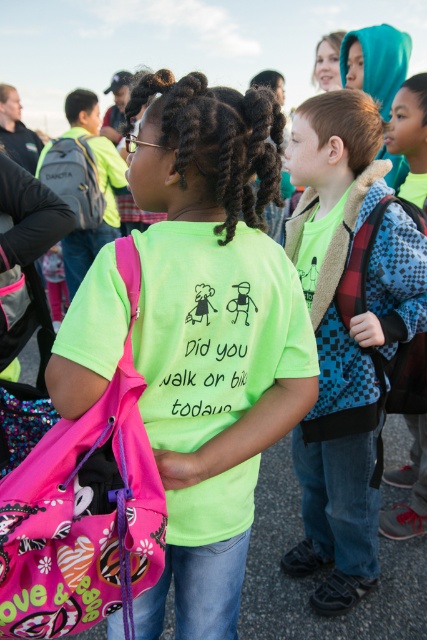
Question: In this image, where is neon green t-shirt at center located relative to green matte pigtail at center?

Choices:
 (A) above
 (B) below

Answer: (B)

Question: Is neon green t-shirt at center positioned at the back of green matte pigtail at center?

Choices:
 (A) no
 (B) yes

Answer: (A)

Question: Is neon green t-shirt at center smaller than green matte pigtail at center?

Choices:
 (A) no
 (B) yes

Answer: (A)

Question: Which of the following is the farthest from the observer?

Choices:
 (A) (175, 168)
 (B) (373, 545)

Answer: (B)

Question: Which point is farther from the camera taking this photo?

Choices:
 (A) (198, 100)
 (B) (417, 284)

Answer: (B)

Question: Which object appears closest to the camera in this image?

Choices:
 (A) neon green t-shirt at center
 (B) green matte pigtail at center
 (C) checkered fabric backpack at center

Answer: (A)